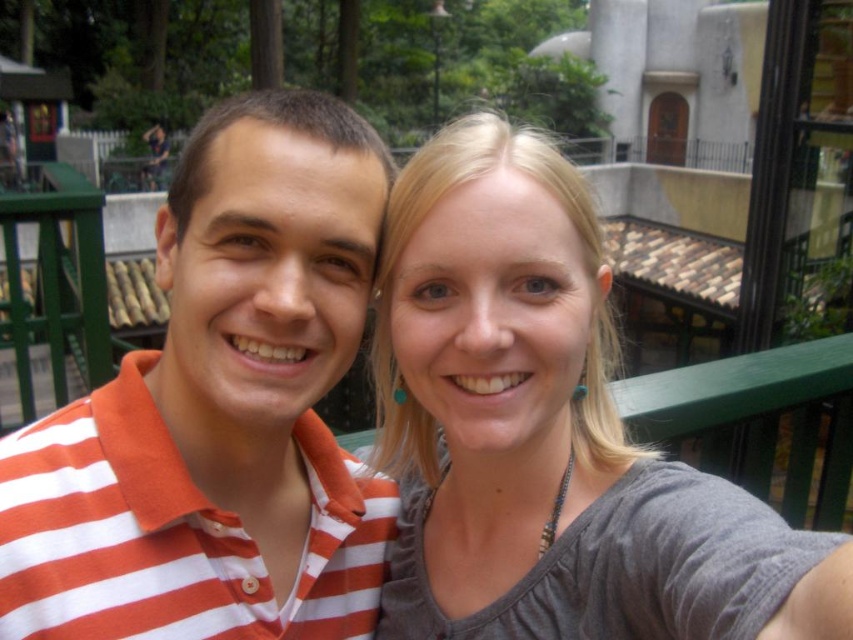
Question: Can you confirm if orange striped shirt at center is positioned to the right of gray fabric shirt at center?

Choices:
 (A) no
 (B) yes

Answer: (A)

Question: Does orange striped shirt at center have a smaller size compared to gray fabric shirt at center?

Choices:
 (A) no
 (B) yes

Answer: (B)

Question: Does orange striped shirt at center appear on the right side of gray fabric shirt at center?

Choices:
 (A) yes
 (B) no

Answer: (B)

Question: Among these objects, which one is nearest to the camera?

Choices:
 (A) orange striped shirt at center
 (B) gray fabric shirt at center

Answer: (B)